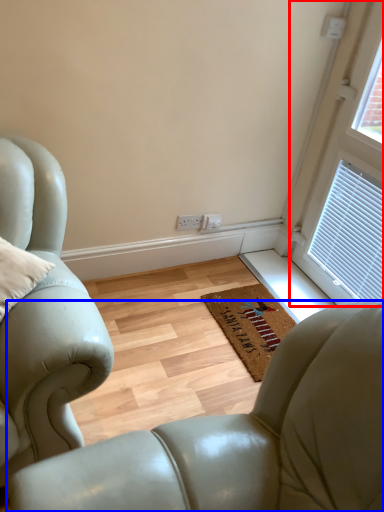
Question: Which point is further to the camera, window (highlighted by a red box) or chair (highlighted by a blue box)?

Choices:
 (A) window
 (B) chair

Answer: (A)